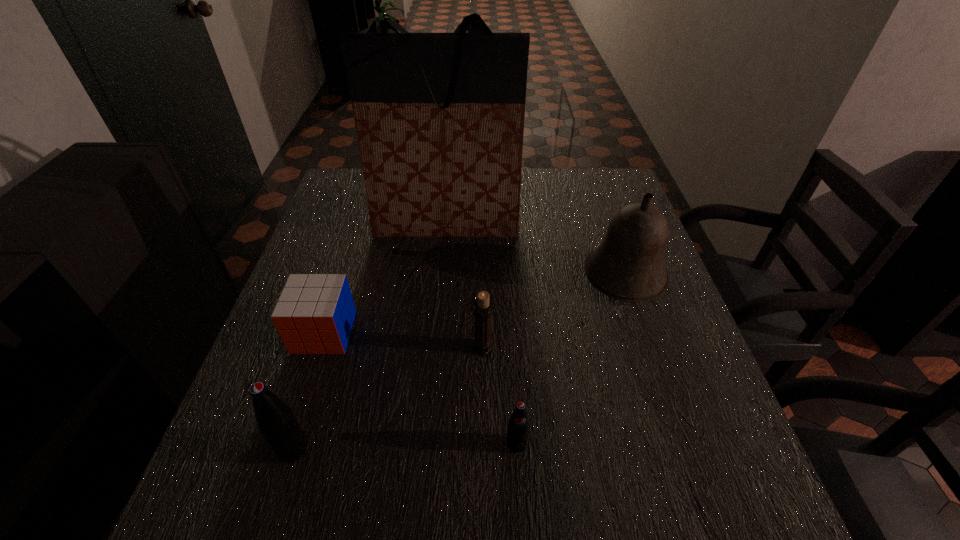
Image resolution: width=960 pixels, height=540 pixels. Identify the location of vacant area situated on the front-facing side of the shopping bag. (442, 280).

What are the coordinates of `vacant space situated 0.120m on the front of the bell` in the screenshot? It's located at (648, 349).

Locate an element on the screen. The image size is (960, 540). blank space located on the back of the candle holder is located at coordinates (483, 252).

This screenshot has width=960, height=540. What are the coordinates of `free region located on the back of the cube` in the screenshot? It's located at (341, 281).

At what (x,y) coordinates should I click in order to perform the action: click on object positioned at the far edge. Please return your answer as a coordinate pair (x, y). This screenshot has width=960, height=540. Looking at the image, I should click on (439, 117).

Find the location of a particular element. The image size is (960, 540). pop located at the left edge is located at coordinates (275, 419).

I want to click on shopping bag situated at the left edge, so click(x=439, y=117).

Where is `cube at the left edge`? This screenshot has width=960, height=540. cube at the left edge is located at coordinates (315, 313).

At what (x,y) coordinates should I click in order to perform the action: click on object present at the right edge. Please return your answer as a coordinate pair (x, y). Looking at the image, I should click on (628, 265).

Where is `object that is positioned at the far left corner`? This screenshot has height=540, width=960. object that is positioned at the far left corner is located at coordinates (439, 117).